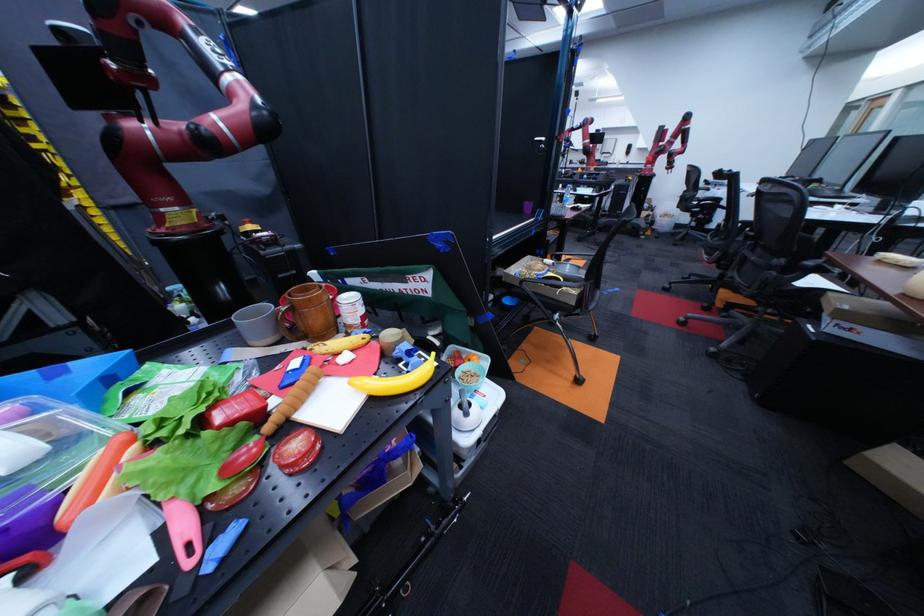
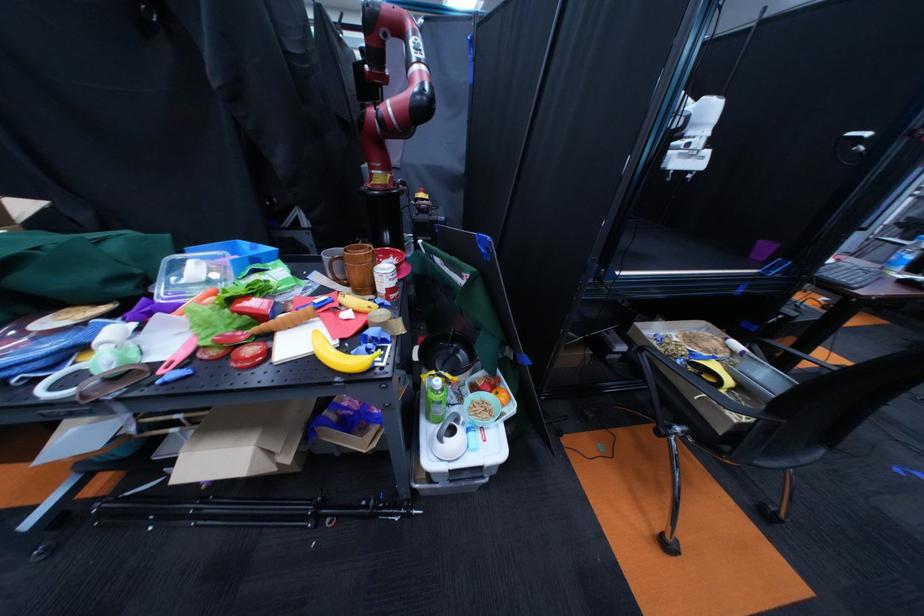
In the second image, find the point that corresponds to (x=553, y=265) in the first image.

(728, 344)